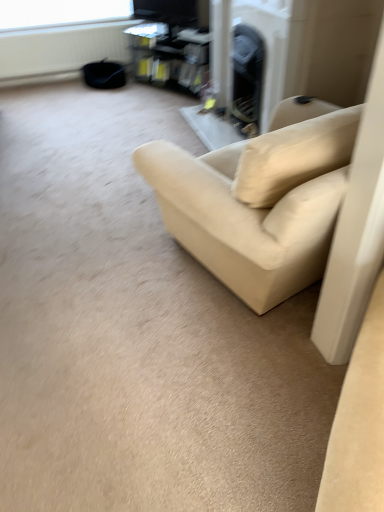
Question: From a real-world perspective, is beige fabric couch at center beneath white matte radiator at upper left?

Choices:
 (A) no
 (B) yes

Answer: (A)

Question: Is the depth of beige fabric couch at center less than that of white matte radiator at upper left?

Choices:
 (A) no
 (B) yes

Answer: (B)

Question: Is beige fabric couch at center positioned behind white matte radiator at upper left?

Choices:
 (A) no
 (B) yes

Answer: (A)

Question: Is beige fabric couch at center not inside white matte radiator at upper left?

Choices:
 (A) yes
 (B) no

Answer: (A)

Question: From a real-world perspective, is beige fabric couch at center physically above white matte radiator at upper left?

Choices:
 (A) yes
 (B) no

Answer: (A)

Question: From the image's perspective, does beige fabric couch at center appear lower than white matte radiator at upper left?

Choices:
 (A) no
 (B) yes

Answer: (B)

Question: Does matte black entertainment center at upper center touch beige fabric couch at center?

Choices:
 (A) yes
 (B) no

Answer: (B)

Question: Is matte black entertainment center at upper center looking in the opposite direction of beige fabric couch at center?

Choices:
 (A) yes
 (B) no

Answer: (B)

Question: Is matte black entertainment center at upper center located outside beige fabric couch at center?

Choices:
 (A) no
 (B) yes

Answer: (B)

Question: Considering the relative sizes of matte black entertainment center at upper center and beige fabric couch at center in the image provided, is matte black entertainment center at upper center smaller than beige fabric couch at center?

Choices:
 (A) yes
 (B) no

Answer: (A)

Question: Is matte black entertainment center at upper center closer to camera compared to beige fabric couch at center?

Choices:
 (A) no
 (B) yes

Answer: (A)

Question: From the image's perspective, is matte black entertainment center at upper center below beige fabric couch at center?

Choices:
 (A) yes
 (B) no

Answer: (B)

Question: Can you confirm if beige fabric couch at center is bigger than matte black entertainment center at upper center?

Choices:
 (A) no
 (B) yes

Answer: (B)